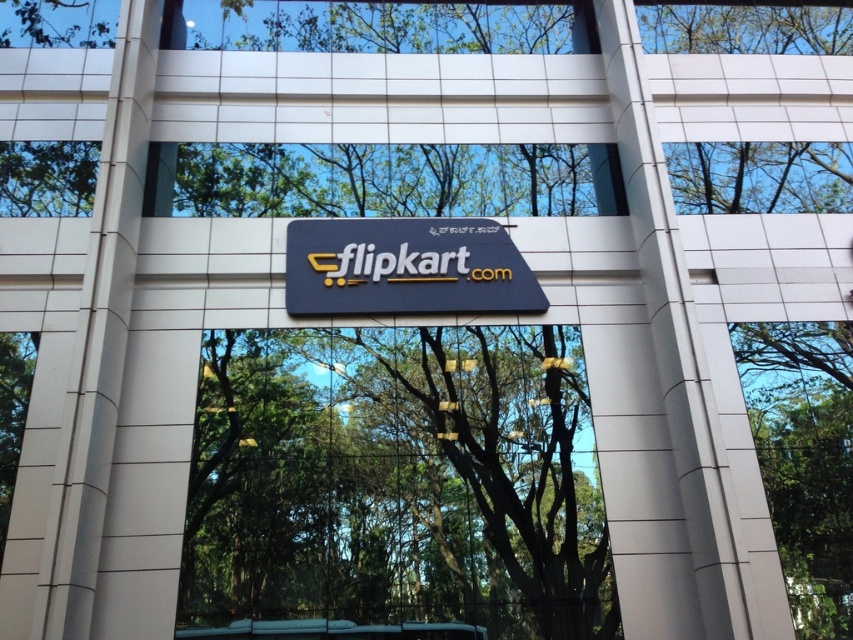
You are standing in front of the Flipkart building and notice the green leafy tree at center and the matte black sign at center. According to the scene, which object is positioned higher?

The matte black sign at center is positioned higher than the green leafy tree at center as it is above it.

You are standing in front of the Flipkart building and want to reach a point that is exactly 29.08 feet away from your current position. The point you need to reach is labeled as point (305, 490). Can you confirm if this point is located on the building facade or somewhere else?

The point (305, 490) is located on the building facade because it is 29.08 feet away from the viewer, which matches the distance specified.

You are standing in front of the building and want to take a photo of the green leafy tree at center and the matte black sign at center. Which object will appear larger in the photo?

The green leafy tree at center will appear larger in the photo because it is taller than the matte black sign at center.